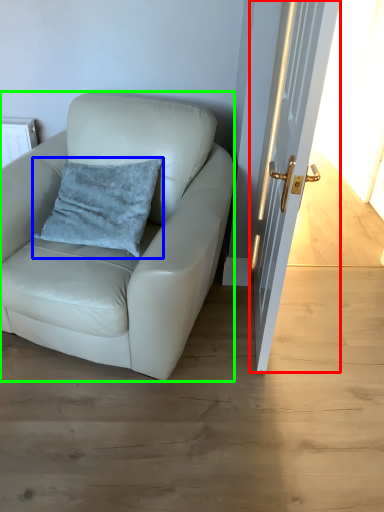
Question: Considering the real-world distances, which object is farthest from door (highlighted by a red box)? pillow (highlighted by a blue box) or chair (highlighted by a green box)?

Choices:
 (A) pillow
 (B) chair

Answer: (A)